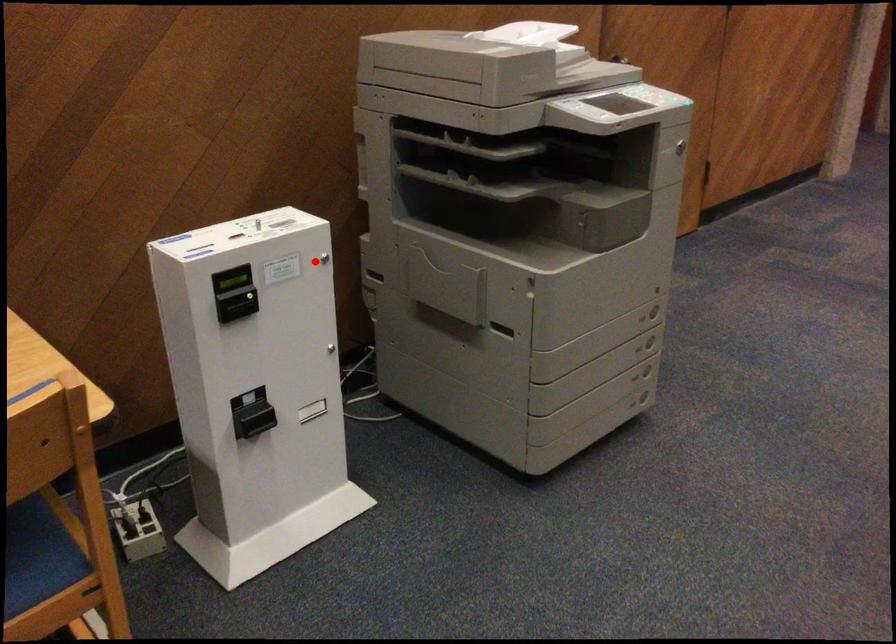
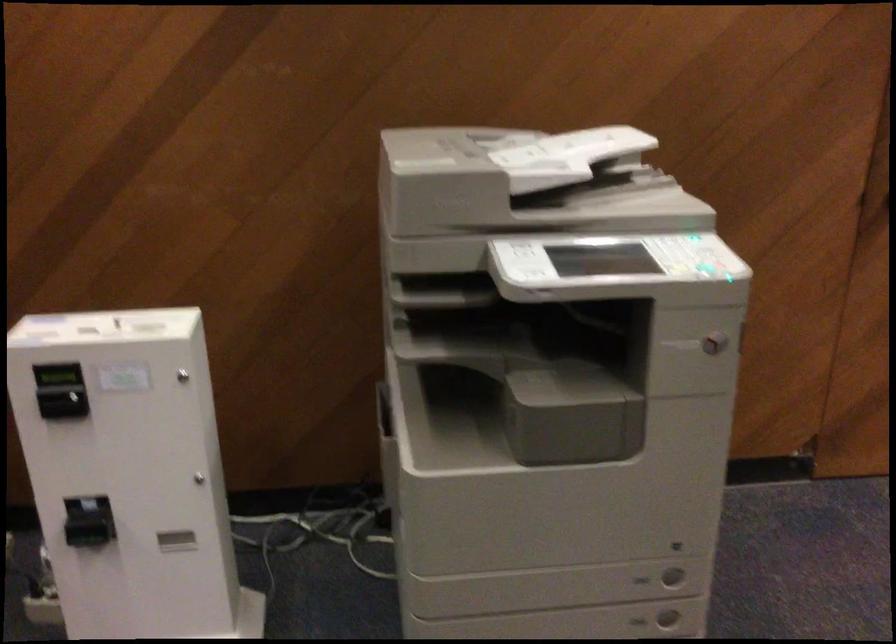
Question: I am providing you with two images of the same scene from different viewpoints. A red point is shown in image1. For the corresponding object point in image2, is it positioned nearer or farther from the camera?

Choices:
 (A) Nearer
 (B) Farther

Answer: (A)